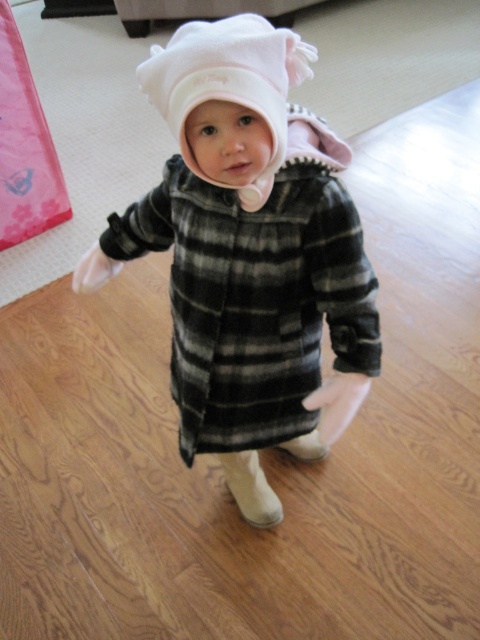
You are a photographer setting up a shoot in this room. You need to place a 12 inch wide prop between the fluffy white hat at center and the white fleece hat at center. Is there enough space between them to fit the prop?

The fluffy white hat at center is wider than the white fleece hat at center, but the description does not provide the exact distance between them. Therefore, it is unclear if there is enough space to fit a 12 inch wide prop between them.

You are a photographer setting up for a portrait of a child wearing two hats. The child is wearing a fluffy white hat at center and a white fleece hat at center. Which hat is taller?

The fluffy white hat at center is taller than the white fleece hat at center.

You are a photographer setting up a shoot in the room. You notice the fluffy white hat at center and the white fleece hat at center. Which hat is positioned lower in the image?

The fluffy white hat at center is positioned lower than the white fleece hat at center.